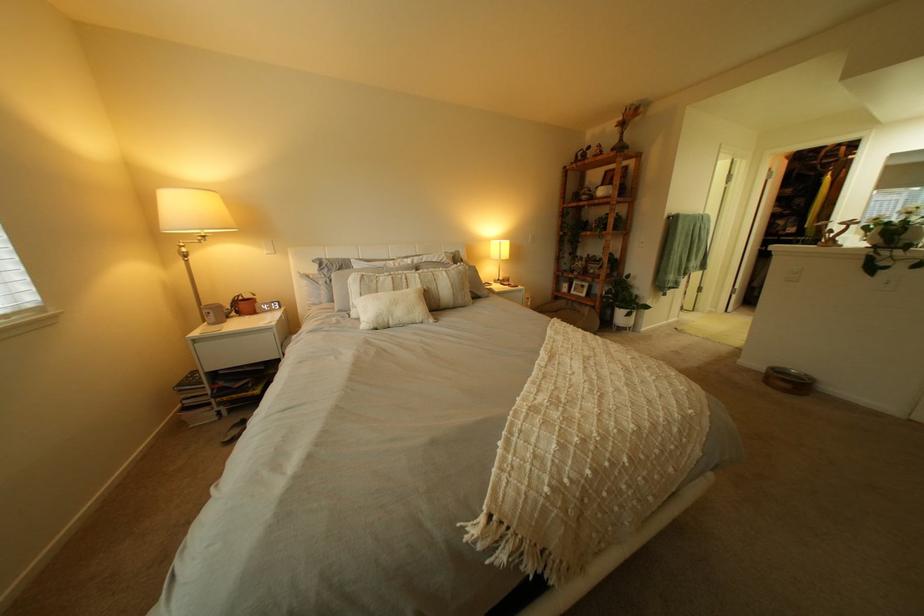
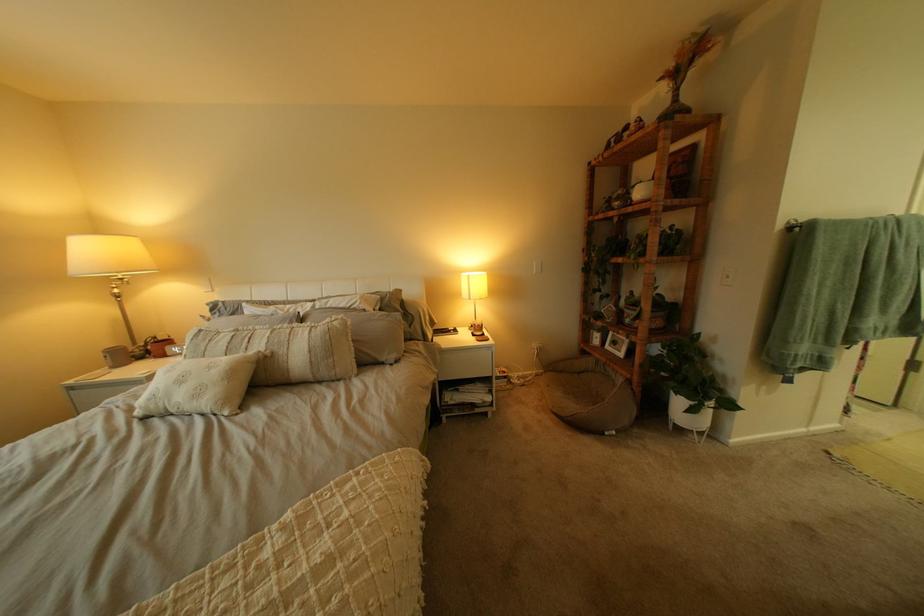
Where in the second image is the point corresponding to [400,320] from the first image?

(176, 405)